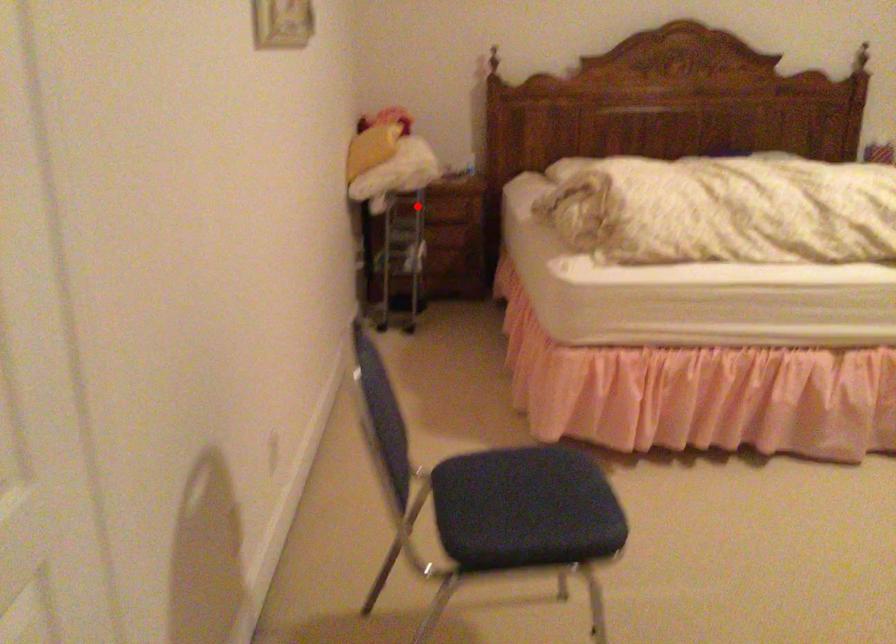
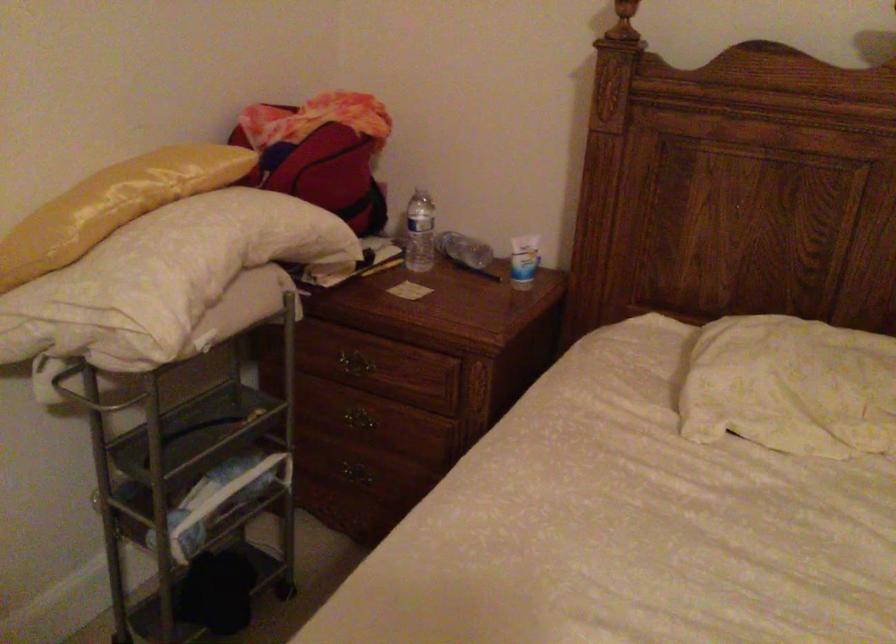
Find the pixel in the second image that matches the highlighted location in the first image.

(350, 365)